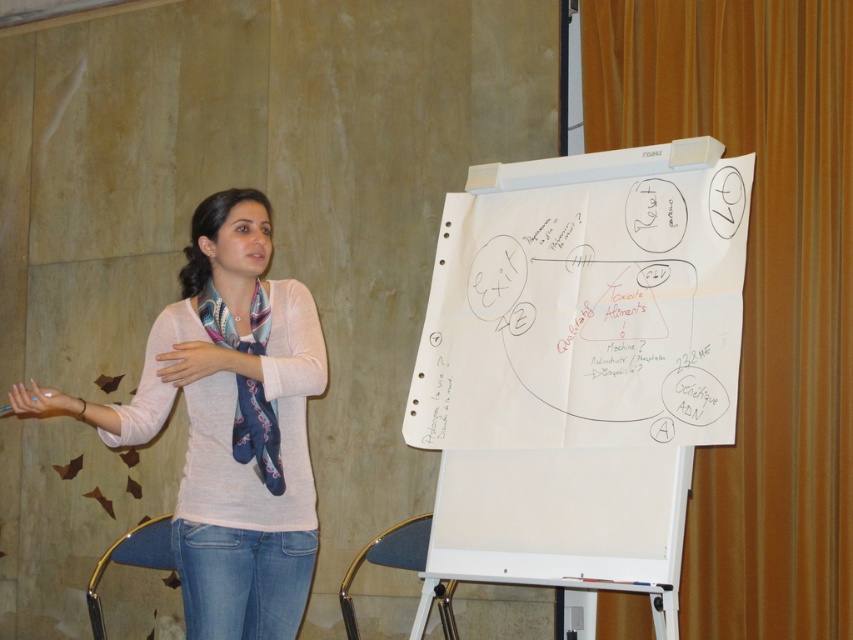
Is point (177, 332) positioned behind point (274, 440)?

Yes, point (177, 332) is behind point (274, 440).

Is the position of light pink sweater at center less distant than that of silky blue scarf at left?

Yes, light pink sweater at center is closer to the viewer.

At what (x,y) coordinates should I click in order to perform the action: click on light pink sweater at center. Please return your answer as a coordinate pair (x, y). The image size is (853, 640). Looking at the image, I should click on (228, 422).

Does white paperboard at center appear on the left side of light pink sweater at center?

Incorrect, white paperboard at center is not on the left side of light pink sweater at center.

Is white paperboard at center thinner than light pink sweater at center?

No, white paperboard at center is not thinner than light pink sweater at center.

Is point (714, 349) farther from viewer compared to point (270, 310)?

No, it is not.

The width and height of the screenshot is (853, 640). Find the location of `white paperboard at center`. white paperboard at center is located at coordinates (579, 362).

Which is behind, point (651, 403) or point (233, 458)?

The point (651, 403) is behind.

Is white paperboard at center smaller than silky blue scarf at left?

Incorrect, white paperboard at center is not smaller in size than silky blue scarf at left.

Where is `white paperboard at center`? This screenshot has width=853, height=640. white paperboard at center is located at coordinates (579, 362).